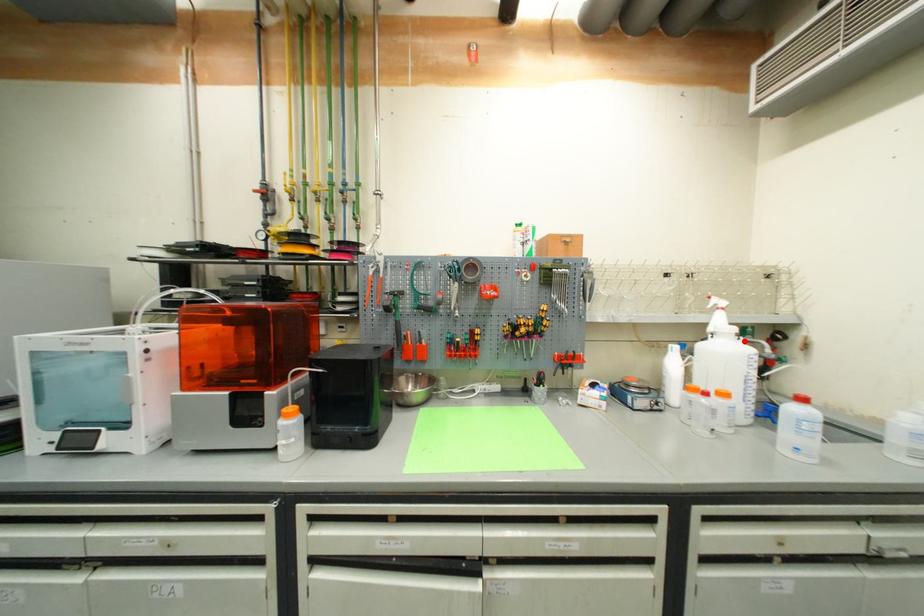
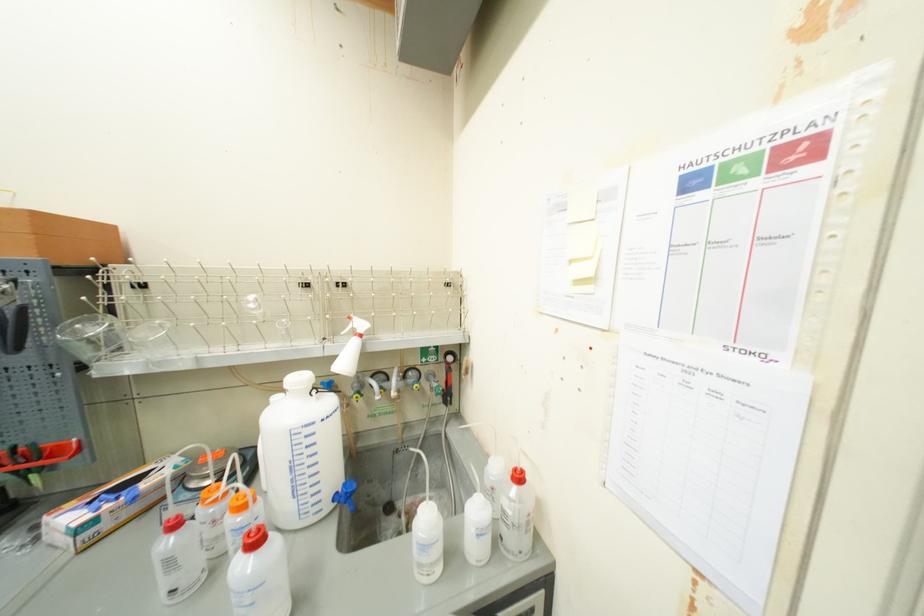
The point at the highlighted location is marked in the first image. Where is the corresponding point in the second image?

(317, 398)